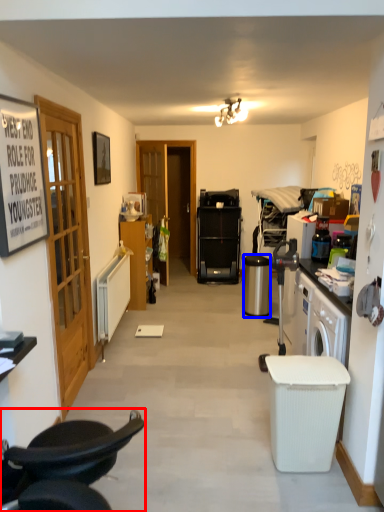
Question: Which object is closer to the camera taking this photo, chair (highlighted by a red box) or trash bin/can (highlighted by a blue box)?

Choices:
 (A) chair
 (B) trash bin/can

Answer: (A)